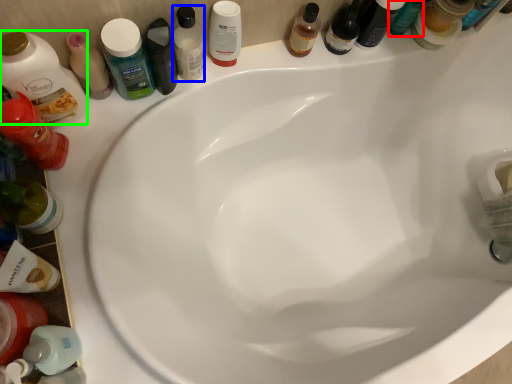
Question: Estimate the real-world distances between objects in this image. Which object is farther from bottle (highlighted by a red box), mouthwash (highlighted by a blue box) or toiletry (highlighted by a green box)?

Choices:
 (A) mouthwash
 (B) toiletry

Answer: (B)